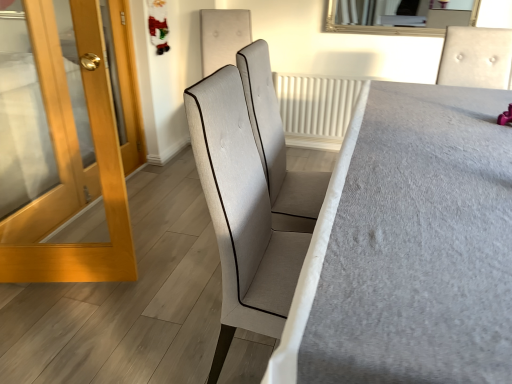
Question: Can you confirm if wooden glossy door at left is positioned to the right of textured fabric chair at center?

Choices:
 (A) no
 (B) yes

Answer: (A)

Question: Is wooden glossy door at left completely or partially outside of textured fabric chair at center?

Choices:
 (A) yes
 (B) no

Answer: (A)

Question: Is wooden glossy door at left far from textured fabric chair at center?

Choices:
 (A) yes
 (B) no

Answer: (A)

Question: Does wooden glossy door at left appear on the left side of textured fabric chair at center?

Choices:
 (A) yes
 (B) no

Answer: (A)

Question: Can you confirm if wooden glossy door at left is taller than textured fabric chair at center?

Choices:
 (A) no
 (B) yes

Answer: (B)

Question: Visually, is textured fabric chair at center positioned to the left or to the right of silver-framed mirror at upper center?

Choices:
 (A) left
 (B) right

Answer: (A)

Question: From the image's perspective, is textured fabric chair at center above or below silver-framed mirror at upper center?

Choices:
 (A) above
 (B) below

Answer: (B)

Question: Is textured fabric chair at center taller or shorter than silver-framed mirror at upper center?

Choices:
 (A) short
 (B) tall

Answer: (B)

Question: Does point coord(458,130) appear closer or farther from the camera than point coord(393,1)?

Choices:
 (A) farther
 (B) closer

Answer: (B)

Question: Is wooden glossy door at left inside the boundaries of light gray fabric chair at center, which ranks as the 1th chair in front-to-back order, or outside?

Choices:
 (A) outside
 (B) inside

Answer: (A)

Question: Considering the positions of wooden glossy door at left and light gray fabric chair at center, marked as the 2th chair in a back-to-front arrangement, in the image, is wooden glossy door at left bigger or smaller than light gray fabric chair at center, marked as the 2th chair in a back-to-front arrangement,?

Choices:
 (A) small
 (B) big

Answer: (A)

Question: Considering their positions, is wooden glossy door at left located in front of or behind light gray fabric chair at center, marked as the 2th chair in a back-to-front arrangement?

Choices:
 (A) front
 (B) behind

Answer: (B)

Question: From a real-world perspective, is wooden glossy door at left positioned above or below light gray fabric chair at center, which ranks as the 1th chair in front-to-back order?

Choices:
 (A) below
 (B) above

Answer: (A)

Question: Based on their positions, is silver-framed mirror at upper center located to the left or right of light gray fabric chair at center, marked as the 2th chair in a back-to-front arrangement?

Choices:
 (A) right
 (B) left

Answer: (A)

Question: From a real-world perspective, is silver-framed mirror at upper center physically located above or below light gray fabric chair at center, which ranks as the 1th chair in front-to-back order?

Choices:
 (A) below
 (B) above

Answer: (B)